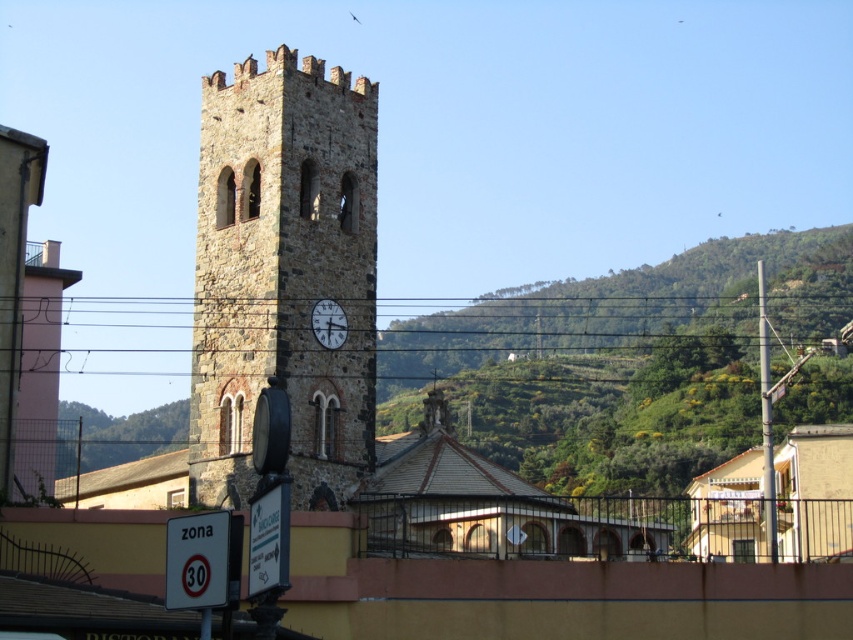
Question: Is stone clock tower at center bigger than matte stone clock at center?

Choices:
 (A) no
 (B) yes

Answer: (B)

Question: From the image, what is the correct spatial relationship of stone clock tower at center in relation to matte stone clock at center?

Choices:
 (A) above
 (B) below

Answer: (A)

Question: Can you confirm if stone clock tower at center is bigger than matte stone clock at center?

Choices:
 (A) no
 (B) yes

Answer: (B)

Question: Which object appears closest to the camera in this image?

Choices:
 (A) stone clock tower at center
 (B) matte stone clock at center

Answer: (A)